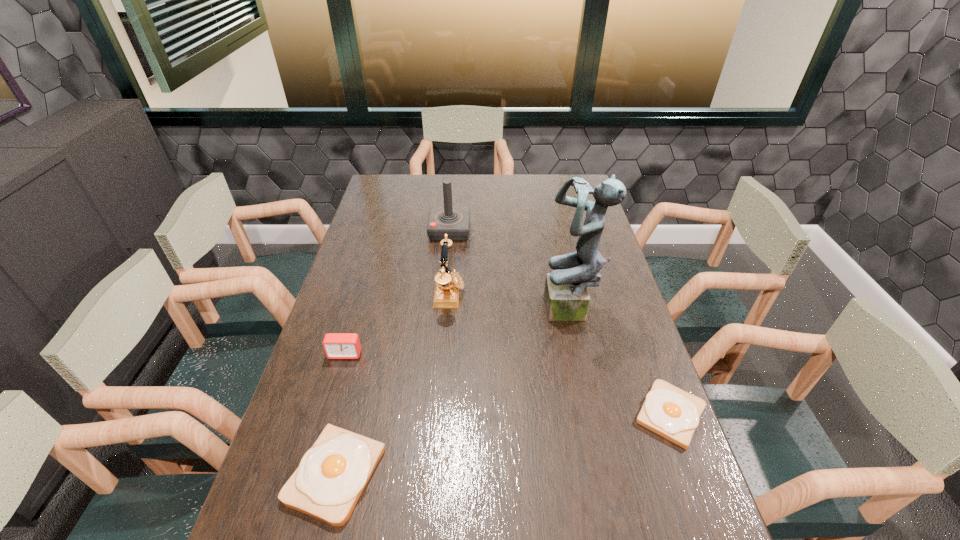
Identify the location of blank region between the right toast and the alarm clock. (508, 384).

What are the coordinates of `empty space between the left toast and the right toast` in the screenshot? It's located at (503, 444).

Image resolution: width=960 pixels, height=540 pixels. Identify the location of vacant area that lies between the third nearest object and the third tallest object. (397, 323).

Image resolution: width=960 pixels, height=540 pixels. Find the location of `free space between the shorter toast and the joystick`. free space between the shorter toast and the joystick is located at coordinates (560, 322).

Locate an element on the screen. This screenshot has height=540, width=960. vacant space in between the joystick and the tallest object is located at coordinates (511, 271).

Locate an element on the screen. The height and width of the screenshot is (540, 960). free space between the second tallest object and the alarm clock is located at coordinates (397, 292).

What are the coordinates of `empty location between the third tallest object and the third shortest object` in the screenshot? It's located at (397, 323).

You are a GUI agent. You are given a task and a screenshot of the screen. Output one action in this format:
    pyautogui.click(x=<x>, y=<y>)
    Task: Click on the empty space between the second object from right to left and the third tallest object
    
    Given the screenshot: What is the action you would take?
    pyautogui.click(x=511, y=302)

In order to click on unoccupied area between the third shortest object and the right toast in this screenshot , I will do `click(508, 384)`.

The image size is (960, 540). Identify the location of free space between the fourth shortest object and the third shortest object. (397, 323).